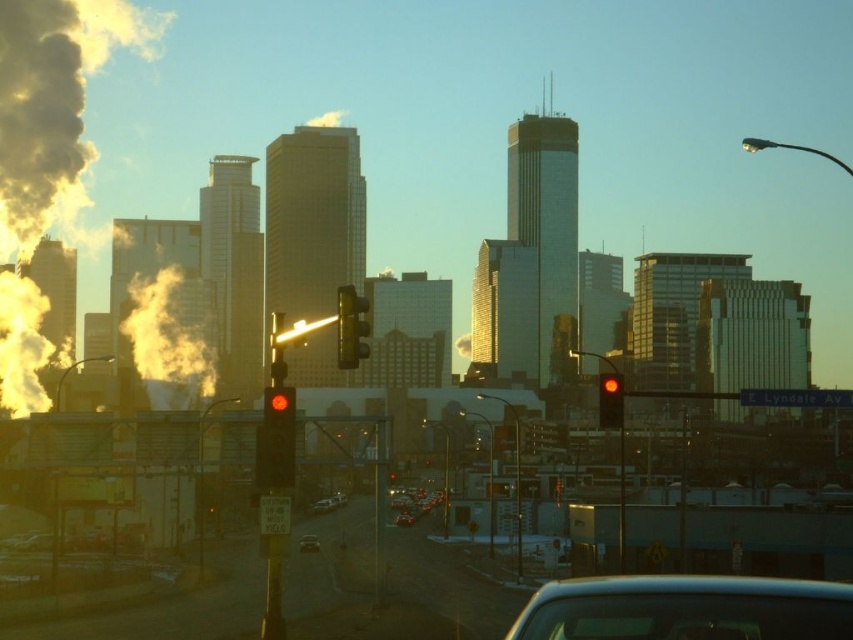
Between metallic silver car at lower center and yellowish foggy smoke at left, which one is positioned lower?

yellowish foggy smoke at left is below.

Is metallic silver car at lower center smaller than yellowish foggy smoke at left?

Yes.

The height and width of the screenshot is (640, 853). I want to click on metallic silver car at lower center, so click(x=686, y=609).

The image size is (853, 640). I want to click on metallic silver car at lower center, so click(x=686, y=609).

Who is lower down, yellowish foggy smoke at left or shiny silver car at center?

Positioned lower is shiny silver car at center.

Who is more forward, (161, 356) or (305, 538)?

Point (305, 538)

What are the coordinates of `yellowish foggy smoke at left` in the screenshot? It's located at (169, 337).

Is red glass traffic light at center thinner than shiny silver car at center?

In fact, red glass traffic light at center might be wider than shiny silver car at center.

Between red glass traffic light at center and shiny silver car at center, which one is positioned lower?

Positioned lower is shiny silver car at center.

Describe the element at coordinates (610, 401) in the screenshot. I see `red glass traffic light at center` at that location.

Identify the location of red glass traffic light at center. (610, 401).